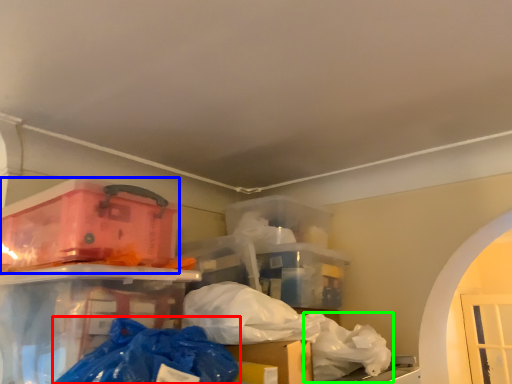
Question: Based on their relative distances, which object is farther from plastic bag (highlighted by a red box)? Choose from box (highlighted by a blue box) and plastic bag (highlighted by a green box).

Choices:
 (A) box
 (B) plastic bag

Answer: (B)